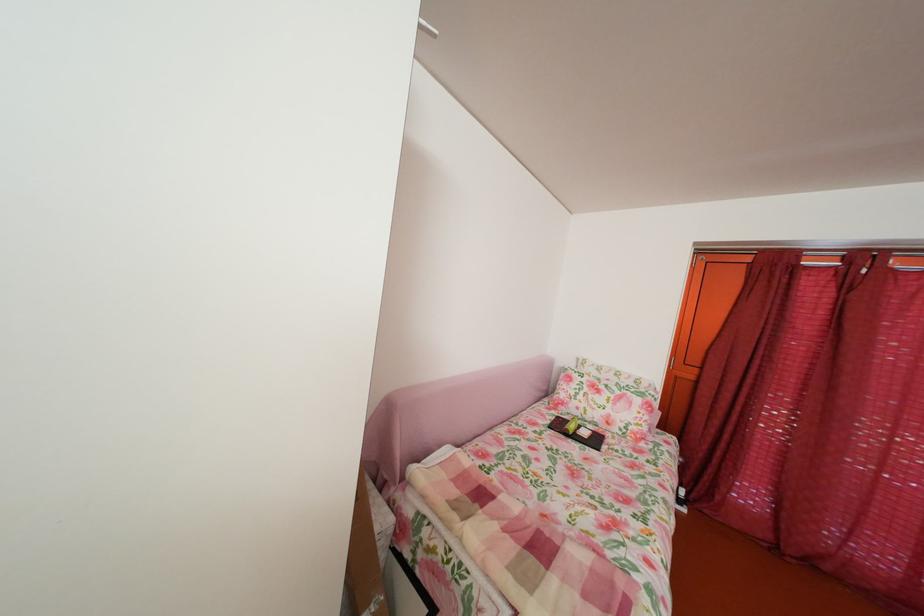
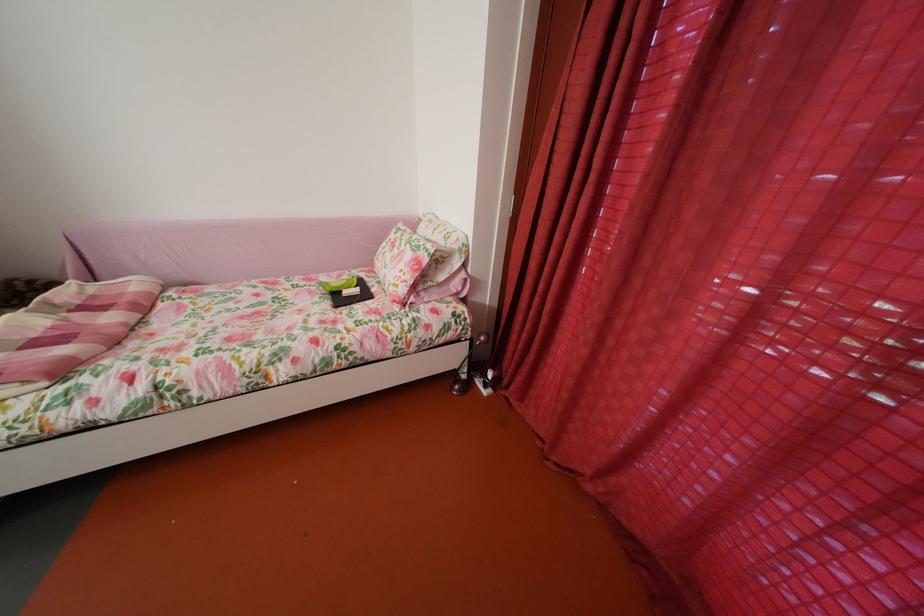
Where in the second image is the point corresponding to (x=649, y=407) from the first image?

(419, 262)